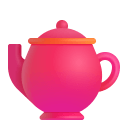
In order to click on teapot in this screenshot , I will do `click(63, 74)`.